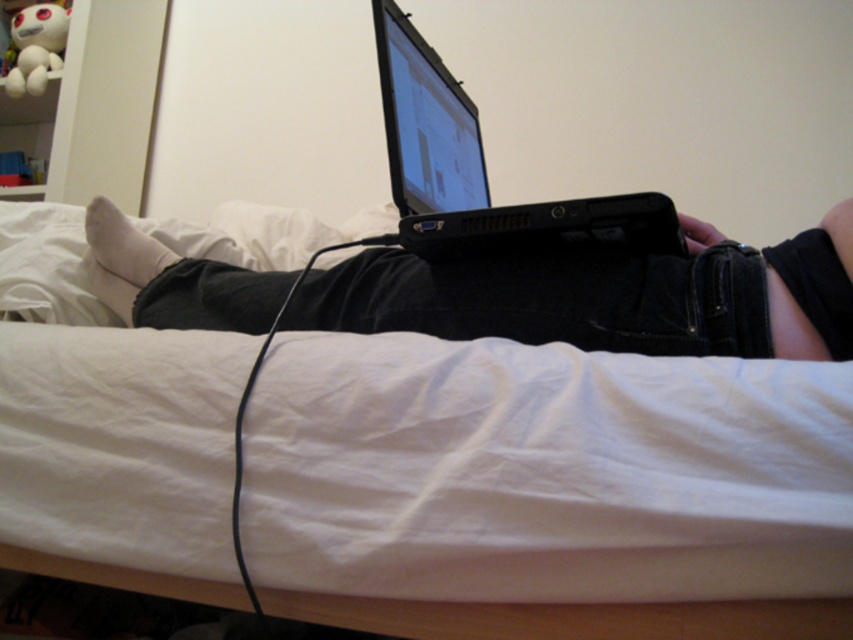
Question: Can you confirm if white fabric bed at center is thinner than black matte laptop at center?

Choices:
 (A) no
 (B) yes

Answer: (B)

Question: Among these objects, which one is farthest from the camera?

Choices:
 (A) black matte laptop at center
 (B) black plastic laptop at center
 (C) white fabric bed at center

Answer: (A)

Question: Where is black matte laptop at center located in relation to black plastic laptop at center in the image?

Choices:
 (A) right
 (B) left

Answer: (B)

Question: Is black matte laptop at center bigger than black plastic laptop at center?

Choices:
 (A) yes
 (B) no

Answer: (B)

Question: Which of the following is the closest to the observer?

Choices:
 (A) (415, 88)
 (B) (312, 308)
 (C) (816, 371)

Answer: (C)

Question: Which point is farther to the camera?

Choices:
 (A) (758, 612)
 (B) (456, 241)

Answer: (B)